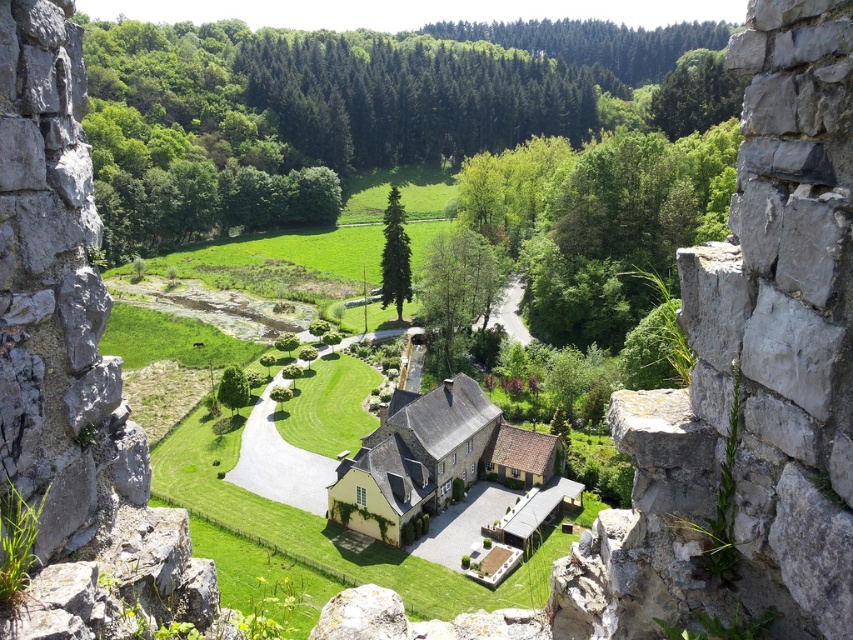
Is yellow matte house at center thinner than green grass at center?

Yes.

Is yellow matte house at center taller than green grass at center?

In fact, yellow matte house at center may be shorter than green grass at center.

Describe the element at coordinates (434, 467) in the screenshot. I see `yellow matte house at center` at that location.

At what (x,y) coordinates should I click in order to perform the action: click on yellow matte house at center. Please return your answer as a coordinate pair (x, y). Looking at the image, I should click on (434, 467).

Who is shorter, rough stone wall at left or yellow matte house at center?

rough stone wall at left is shorter.

Who is positioned more to the right, rough stone wall at left or yellow matte house at center?

yellow matte house at center is more to the right.

Identify the location of rough stone wall at left. The image size is (853, 640). (73, 371).

Does rough stone wall at left appear on the left side of green grass at center?

In fact, rough stone wall at left is to the right of green grass at center.

Which of these two, rough stone wall at left or green grass at center, stands shorter?

Standing shorter between the two is rough stone wall at left.

Is point (193, 602) positioned behind point (250, 467)?

No, (193, 602) is in front of (250, 467).

This screenshot has height=640, width=853. I want to click on rough stone wall at left, so click(x=73, y=371).